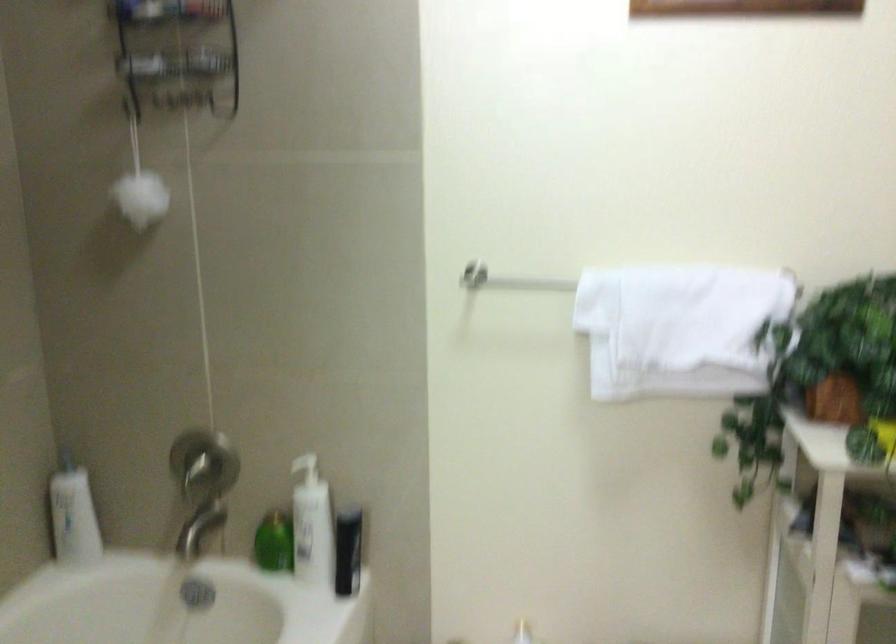
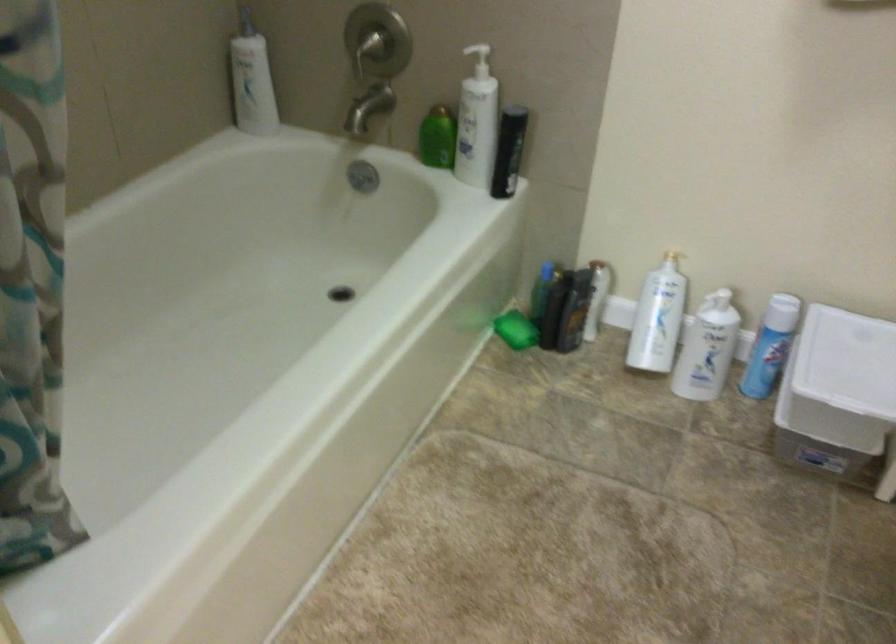
Locate, in the second image, the point that corresponds to (309,467) in the first image.

(478, 57)